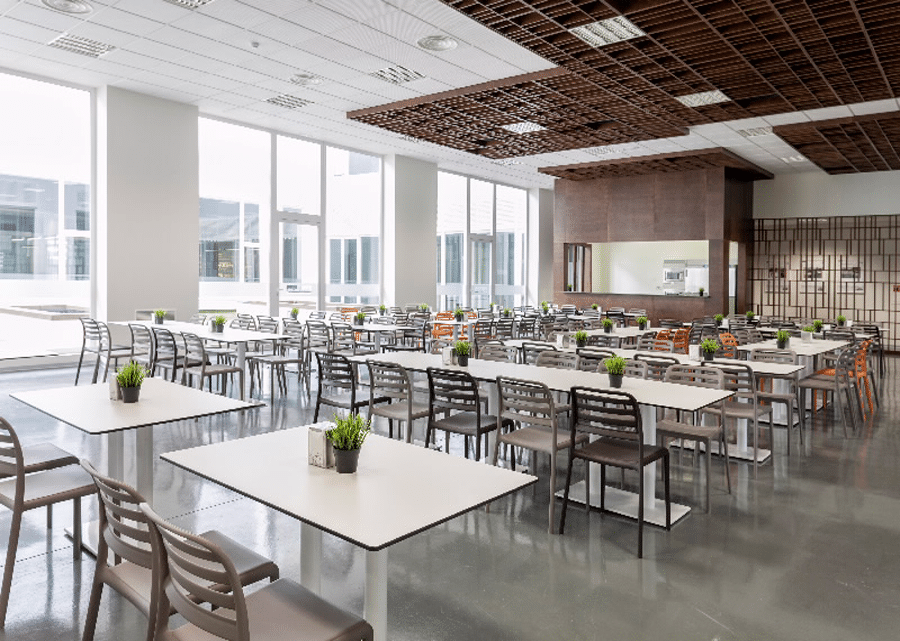
Locate an element on the screen. windows is located at coordinates (49, 196), (230, 194), (312, 256), (342, 253), (319, 194), (455, 235), (483, 220), (516, 231), (480, 281).